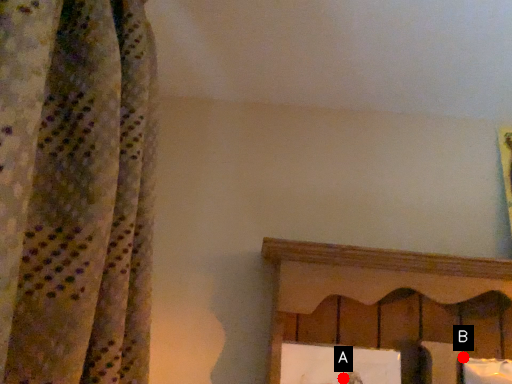
Question: Two points are circled on the image, labeled by A and B beside each circle. Which of the following is the farthest from the observer?

Choices:
 (A) A is further
 (B) B is further

Answer: (B)